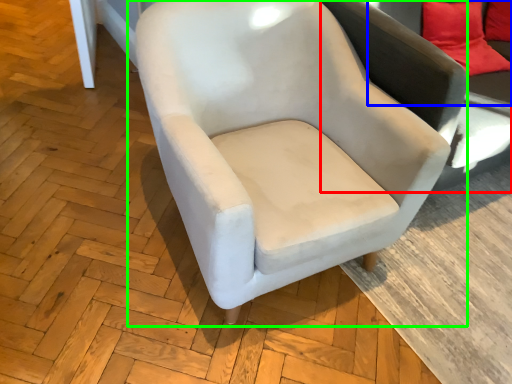
Question: Which object is positioned farthest from swivel chair (highlighted by a red box)? Select from couch (highlighted by a blue box) and chair (highlighted by a green box).

Choices:
 (A) couch
 (B) chair

Answer: (A)